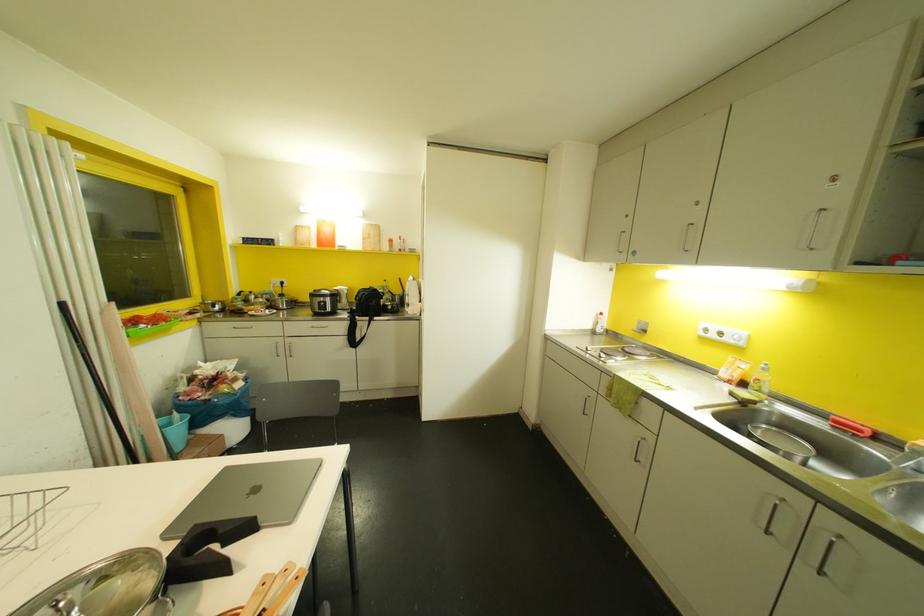
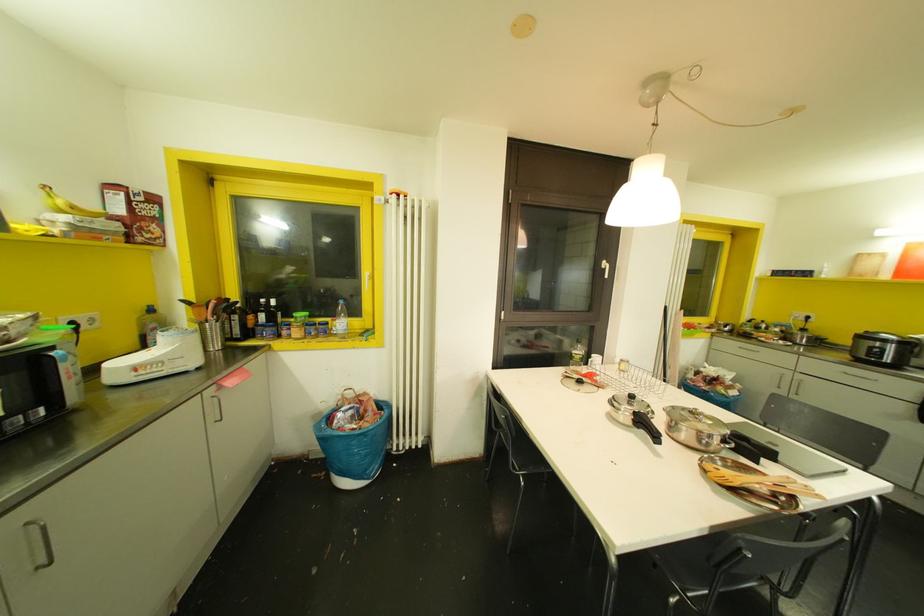
Where in the second image is the point corresponding to [287,347] from the first image?

(796, 383)